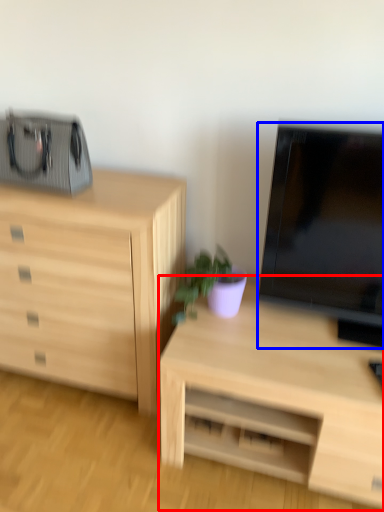
Question: Which object appears farthest to the camera in this image, desk (highlighted by a red box) or television (highlighted by a blue box)?

Choices:
 (A) desk
 (B) television

Answer: (A)